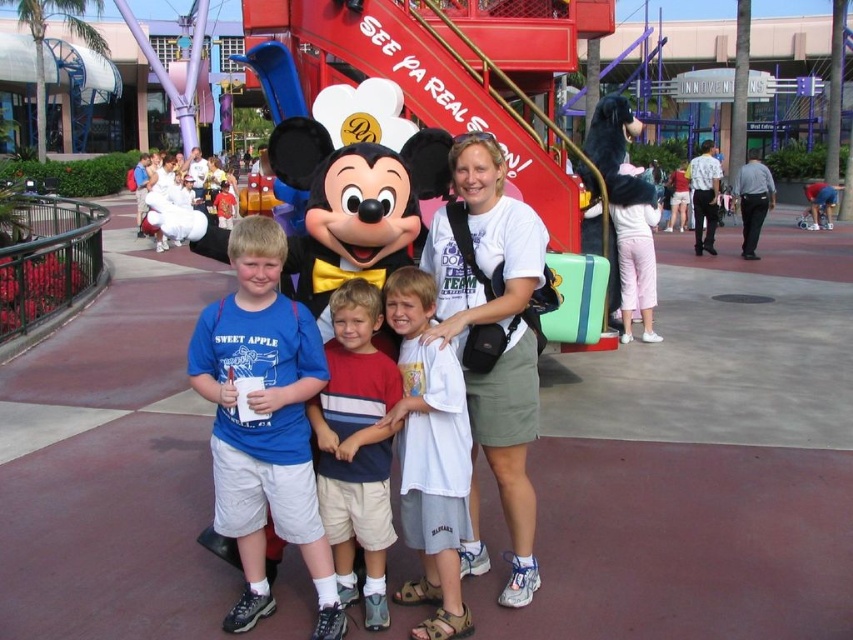
Question: Can you confirm if matte black costume at center is positioned to the right of light brown cotton shorts at center?

Choices:
 (A) no
 (B) yes

Answer: (A)

Question: Which of the following is the closest to the observer?

Choices:
 (A) light brown cotton shorts at center
 (B) blue cotton shirt at center

Answer: (B)

Question: Which of the following is the farthest from the observer?

Choices:
 (A) white cotton shirt at center
 (B) blue cotton shirt at center
 (C) white plush bear at upper left

Answer: (C)

Question: Which point is closer to the camera?

Choices:
 (A) matte black costume at center
 (B) blue cotton shirt at center
 (C) light brown cotton shorts at center
 (D) white plush bear at upper left

Answer: (B)

Question: Does matte black costume at center have a larger size compared to white plush bear at upper left?

Choices:
 (A) no
 (B) yes

Answer: (A)

Question: Does light brown cotton shorts at center appear on the right side of white plush bear at upper left?

Choices:
 (A) no
 (B) yes

Answer: (B)